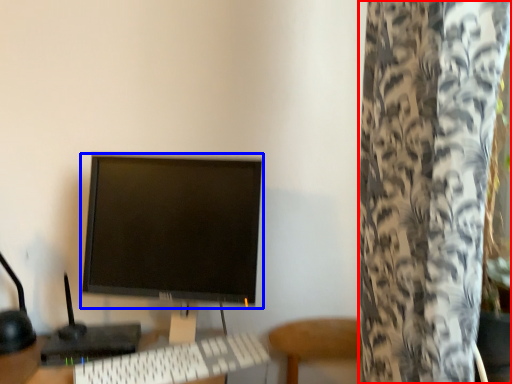
Question: Which point is further to the camera, curtain (highlighted by a red box) or computer monitor (highlighted by a blue box)?

Choices:
 (A) curtain
 (B) computer monitor

Answer: (B)